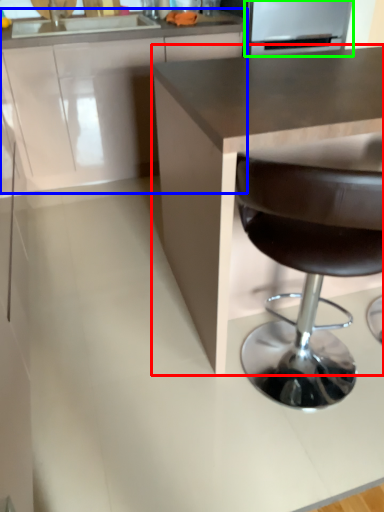
Question: Estimate the real-world distances between objects in this image. Which object is closer to countertop (highlighted by a red box), cabinetry (highlighted by a blue box) or appliance (highlighted by a green box)?

Choices:
 (A) cabinetry
 (B) appliance

Answer: (A)